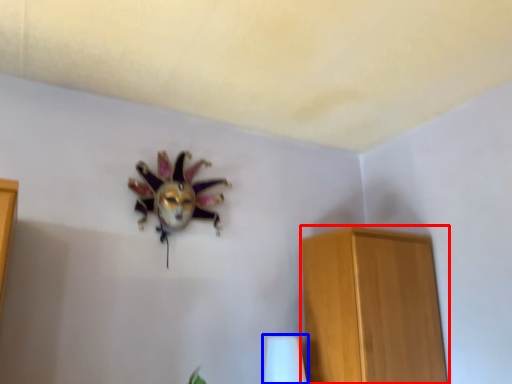
Question: Which object is closer to the camera taking this photo, furniture (highlighted by a red box) or table lamp (highlighted by a blue box)?

Choices:
 (A) furniture
 (B) table lamp

Answer: (A)